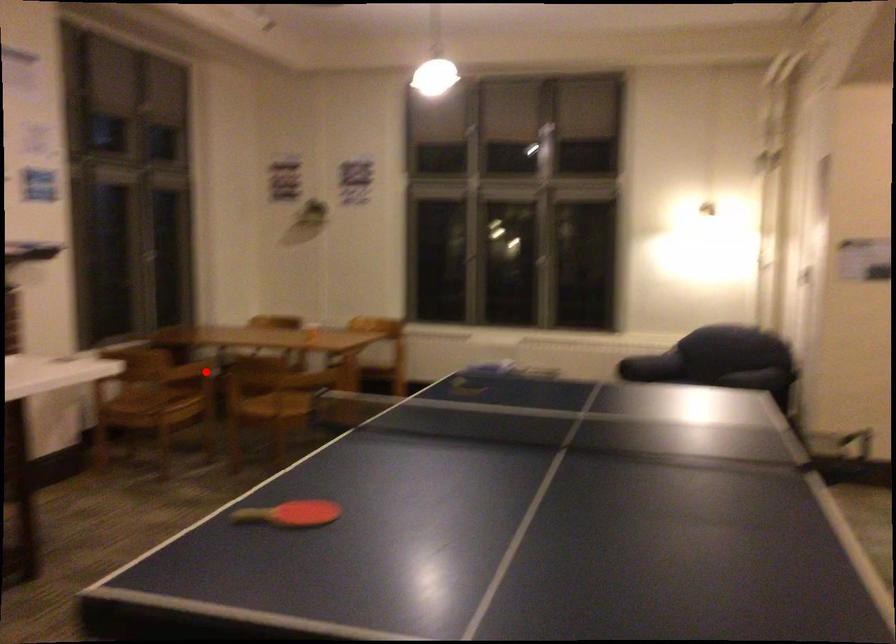
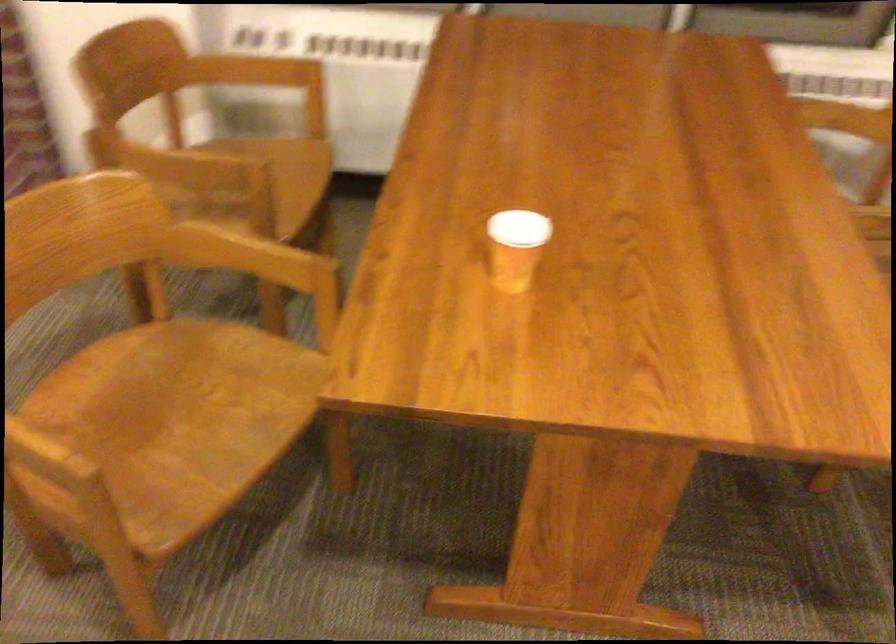
Question: I am providing you with two images of the same scene from different viewpoints. Image1 has a red point marked. In image2, the corresponding 3D location appears at what relative position? Reply with the corresponding letter.

Choices:
 (A) Closer
 (B) Farther

Answer: (A)